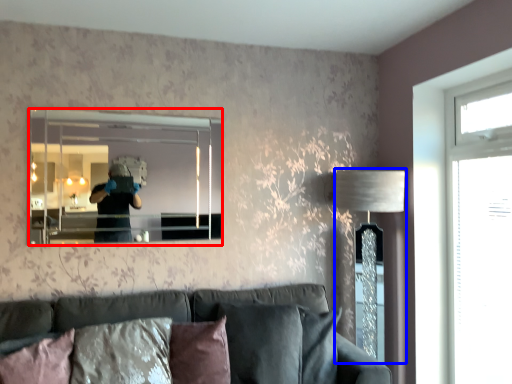
Question: Which of the following is the farthest to the observer, mirror (highlighted by a red box) or table lamp (highlighted by a blue box)?

Choices:
 (A) mirror
 (B) table lamp

Answer: (B)